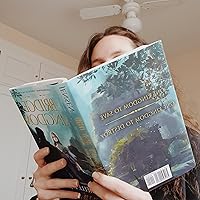
Identify the location of book. (102, 91).